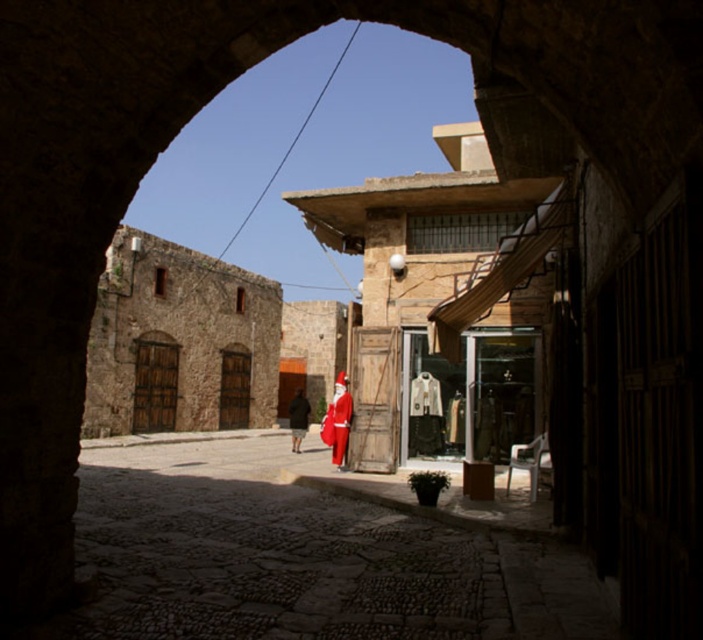
You are a delivery person who needs to place a large package in the courtyard. The package requires a space of at least 20 meters between two points. Looking at the courtyard through the stone archway, can you determine if there is enough space between the red matte santa suit at center and the red velvet santa suit at center to place the package?

The red matte santa suit at center and the red velvet santa suit at center are 19.19 meters apart, which is less than the required 20 meters. Therefore, there isn not enough space to place the package between them.

You are standing in the courtyard and want to take a photo of the point at coordinates (335, 392). Given that your camera has a maximum focus range of 50 meters, will you be able to focus on the point?

The point at coordinates (335, 392) is 55.18 meters away from the viewer, which exceeds the camera maximum focus range of 50 meters. Therefore, the camera cannot focus on the point.